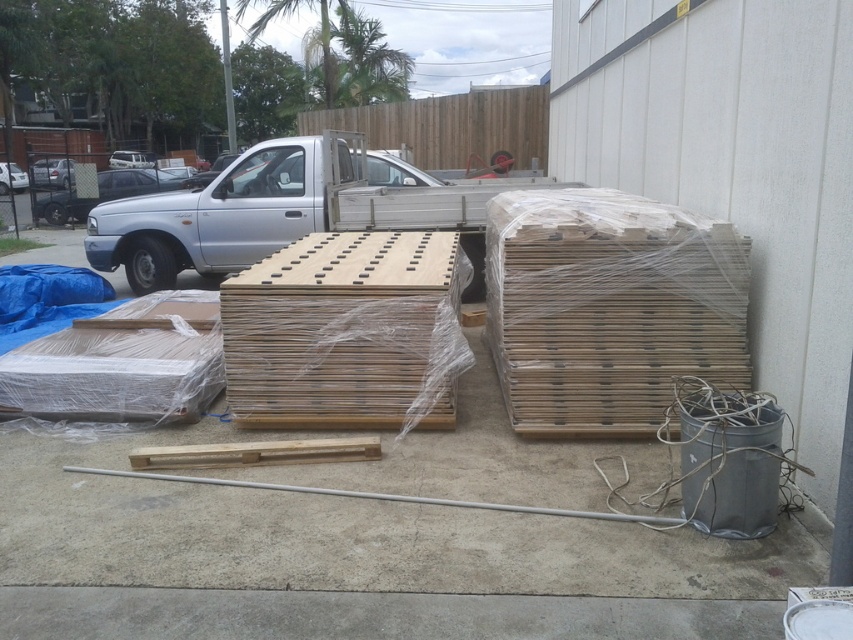
Can you confirm if wooden crates at right is wider than natural wood crate at center?

No, wooden crates at right is not wider than natural wood crate at center.

You are a GUI agent. You are given a task and a screenshot of the screen. Output one action in this format:
    pyautogui.click(x=<x>, y=<y>)
    Task: Click on the wooden crates at right
    
    Given the screenshot: What is the action you would take?
    pyautogui.click(x=608, y=307)

The image size is (853, 640). What are the coordinates of `wooden crates at right` in the screenshot? It's located at (608, 307).